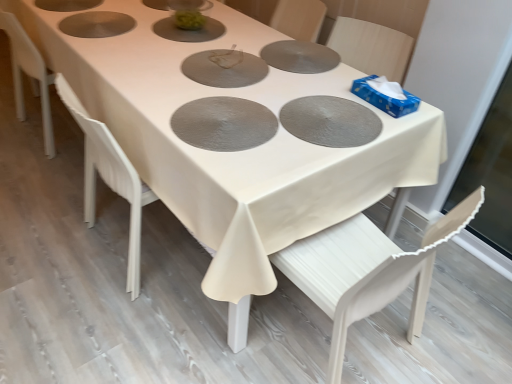
Locate an element on the screen. free space that is to the left of textured silver pizza pan at center, which is counted as the third pizza pan, starting from the top is located at coordinates (147, 96).